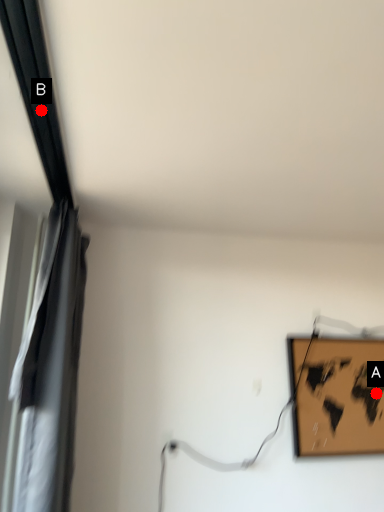
Question: Two points are circled on the image, labeled by A and B beside each circle. Among these points, which one is nearest to the camera?

Choices:
 (A) A is closer
 (B) B is closer

Answer: (B)